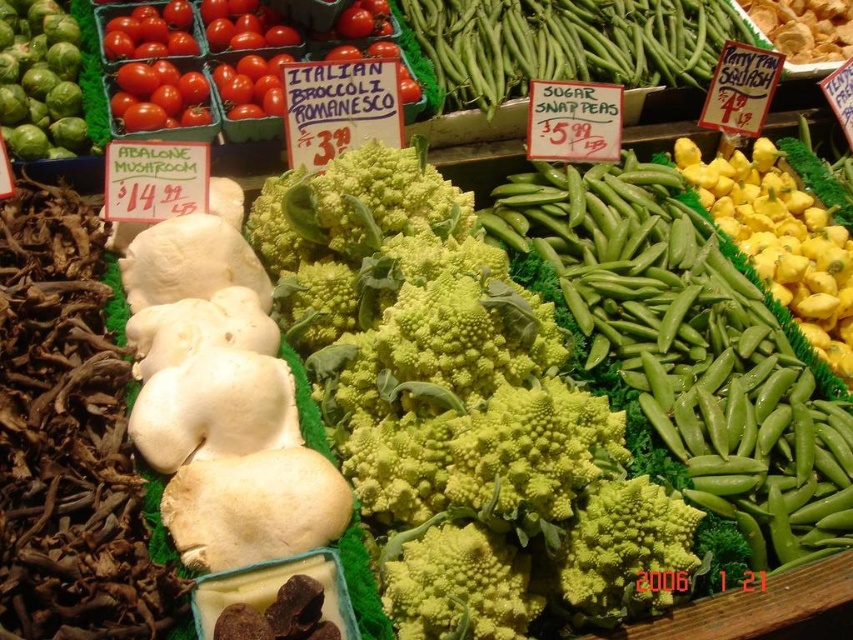
You are a chef preparing a dish and need to choose between the green rough broccoli at center and the green smooth sugar snap peas at center based on their size. Which one is wider?

The green rough broccoli at center is wider than the green smooth sugar snap peas at center.

You are a customer at the market stall and want to find the green rough broccoli at center. According to the coordinates given, where exactly is it located in the image?

The green rough broccoli at center is located at the 2D coordinates point of (x=457, y=401).